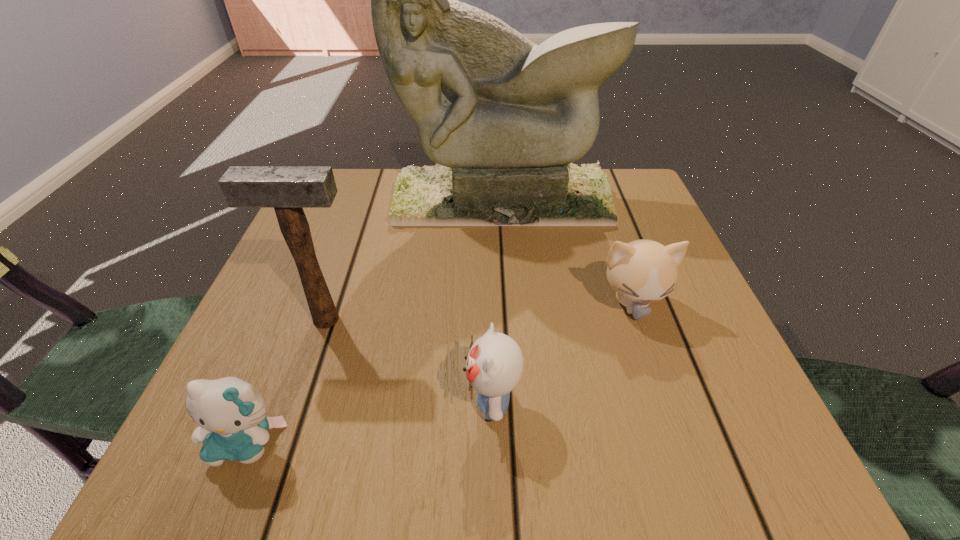
In order to click on sculpture in this screenshot , I will do pos(501,116).

At what (x,y) coordinates should I click in order to perform the action: click on the tallest object. Please return your answer as a coordinate pair (x, y). This screenshot has height=540, width=960. Looking at the image, I should click on (501, 116).

Locate an element on the screen. The height and width of the screenshot is (540, 960). mallet is located at coordinates (288, 189).

I want to click on the rightmost kitten, so point(642,271).

At what (x,y) coordinates should I click in order to perform the action: click on the second kitten from left to right. Please return your answer as a coordinate pair (x, y). Looking at the image, I should click on (494, 366).

You are a GUI agent. You are given a task and a screenshot of the screen. Output one action in this format:
    pyautogui.click(x=<x>, y=<y>)
    Task: Click on the leftmost kitten
    Image resolution: width=960 pixels, height=540 pixels.
    Given the screenshot: What is the action you would take?
    pyautogui.click(x=231, y=414)

I want to click on blank area located 0.370m on the base of the tallest object, so click(513, 369).

The image size is (960, 540). Find the location of `blank space located on the right of the fourth shortest object`. blank space located on the right of the fourth shortest object is located at coordinates (588, 320).

Identify the location of free space located on the face of the farthest kitten. (684, 453).

The image size is (960, 540). Identify the location of vacant space positioned on the front-facing side of the second kitten from right to left. [x=236, y=402].